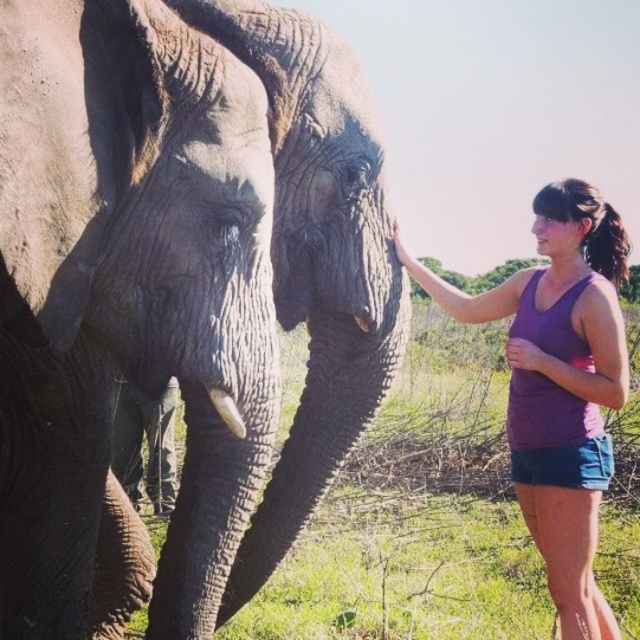
Question: Considering the relative positions of purple fabric tank top at upper right and white ivory tusk at lower left in the image provided, where is purple fabric tank top at upper right located with respect to white ivory tusk at lower left?

Choices:
 (A) above
 (B) below

Answer: (B)

Question: Considering the real-world distances, which object is farthest from the gray rough skin elephant at center?

Choices:
 (A) white ivory tusk at lower left
 (B) purple fabric tank top at upper right

Answer: (B)

Question: Among these objects, which one is nearest to the camera?

Choices:
 (A) white ivory tusk at lower left
 (B) gray rough skin elephant at center

Answer: (B)

Question: Can you confirm if gray rough skin elephant at center is positioned to the left of white ivory tusk at lower left?

Choices:
 (A) no
 (B) yes

Answer: (B)

Question: Can you confirm if gray rough skin elephant at center is positioned to the right of purple fabric tank top at upper right?

Choices:
 (A) yes
 (B) no

Answer: (B)

Question: Which point is closer to the camera taking this photo?

Choices:
 (A) (604, 596)
 (B) (221, 419)

Answer: (B)